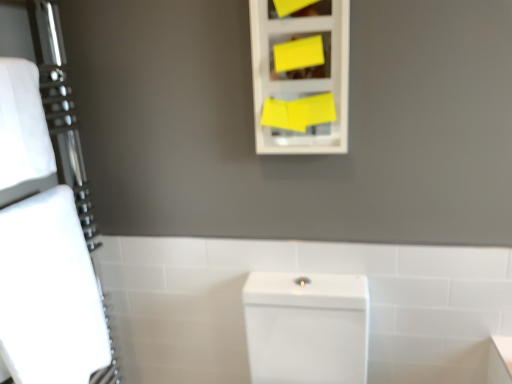
Question: Is white glossy toilet at center thinner than yellow matte cabinet at upper center?

Choices:
 (A) no
 (B) yes

Answer: (B)

Question: Is white glossy toilet at center located outside yellow matte cabinet at upper center?

Choices:
 (A) yes
 (B) no

Answer: (A)

Question: Does white glossy toilet at center appear on the left side of yellow matte cabinet at upper center?

Choices:
 (A) no
 (B) yes

Answer: (B)

Question: Does white glossy toilet at center have a lesser height compared to yellow matte cabinet at upper center?

Choices:
 (A) yes
 (B) no

Answer: (B)

Question: Are white glossy toilet at center and yellow matte cabinet at upper center making contact?

Choices:
 (A) yes
 (B) no

Answer: (B)

Question: Does white glossy toilet at center have a larger size compared to yellow matte cabinet at upper center?

Choices:
 (A) yes
 (B) no

Answer: (A)

Question: From a real-world perspective, is yellow matte cabinet at upper center located higher than white matte bath towel at left, acting as the second bath towel starting from the bottom?

Choices:
 (A) yes
 (B) no

Answer: (A)

Question: Does yellow matte cabinet at upper center have a greater width compared to white matte bath towel at left, which is the first bath towel in top-to-bottom order?

Choices:
 (A) yes
 (B) no

Answer: (B)

Question: Could white matte bath towel at left, acting as the second bath towel starting from the bottom, be considered to be inside yellow matte cabinet at upper center?

Choices:
 (A) yes
 (B) no

Answer: (B)

Question: Considering the relative sizes of yellow matte cabinet at upper center and white matte bath towel at left, acting as the second bath towel starting from the bottom, in the image provided, is yellow matte cabinet at upper center thinner than white matte bath towel at left, acting as the second bath towel starting from the bottom,?

Choices:
 (A) yes
 (B) no

Answer: (A)

Question: Considering the relative positions of yellow matte cabinet at upper center and white matte bath towel at left, acting as the second bath towel starting from the bottom, in the image provided, is yellow matte cabinet at upper center behind white matte bath towel at left, acting as the second bath towel starting from the bottom,?

Choices:
 (A) yes
 (B) no

Answer: (A)

Question: Can you confirm if yellow matte cabinet at upper center is shorter than white matte bath towel at left, acting as the second bath towel starting from the bottom?

Choices:
 (A) no
 (B) yes

Answer: (A)

Question: Does white glossy toilet at center have a lesser width compared to white glossy porcelain at center?

Choices:
 (A) yes
 (B) no

Answer: (A)